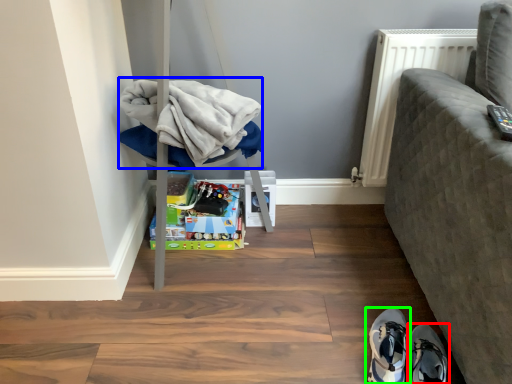
Question: Which object is the farthest from footwear (highlighted by a red box)? Choose among these: clothing (highlighted by a blue box) or footwear (highlighted by a green box).

Choices:
 (A) clothing
 (B) footwear

Answer: (A)